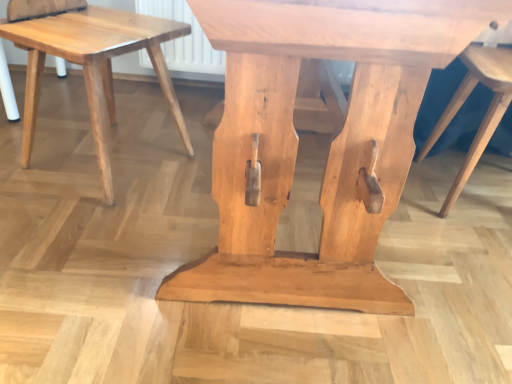
Find the location of a particular element. vacant space behind natural wood stool at lower left, arranged as the first stool when viewed from the left is located at coordinates (142, 107).